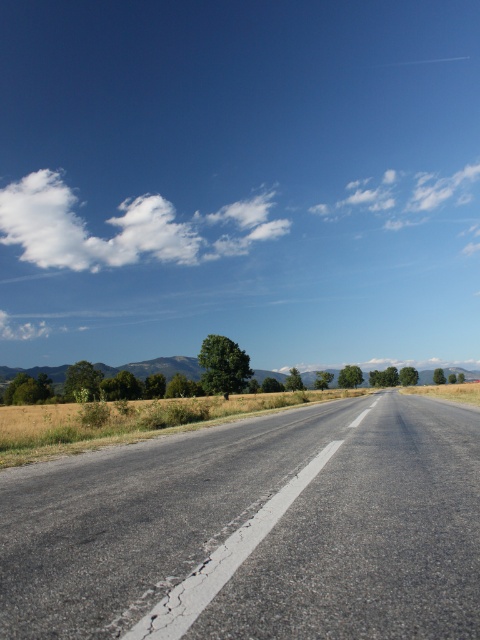
You are driving a car and see the asphalt road at center and the white fluffy cloud at upper left. Which one is closer to you?

The asphalt road at center is closer to you because it is in front of the white fluffy cloud at upper left.

You are driving a car and see the asphalt road at center and the white fluffy cloud at upper left. Which object is positioned lower in the image?

The asphalt road at center is located below the white fluffy cloud at upper left, so the asphalt road at center is positioned lower.

From the picture: You are driving a car and see two points on the road ahead. The first point is at coordinate point (92, 506) and the second is at point (151, 250). Which point is closer to your current position?

Point (151, 250) is closer to your current position because it is behind point (92, 506), which is further ahead.